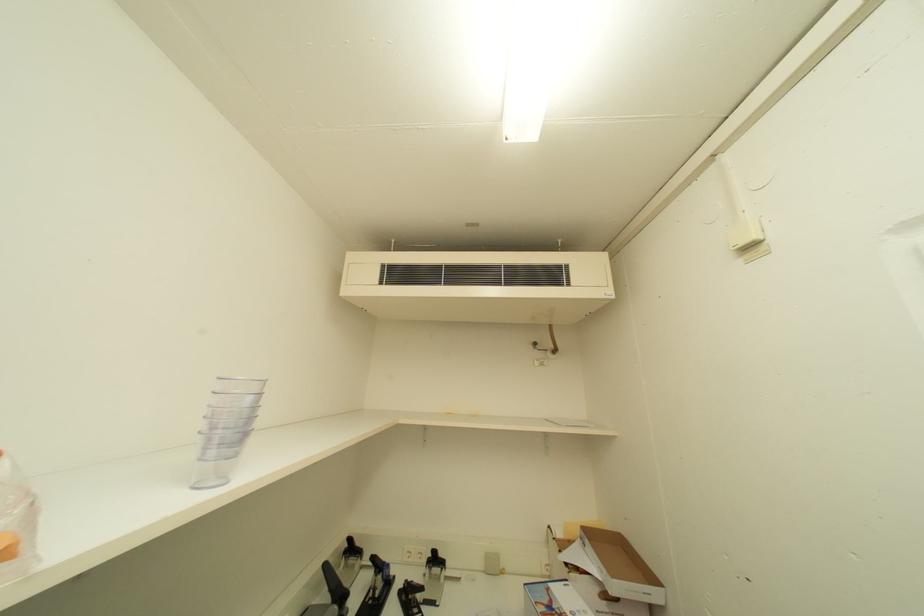
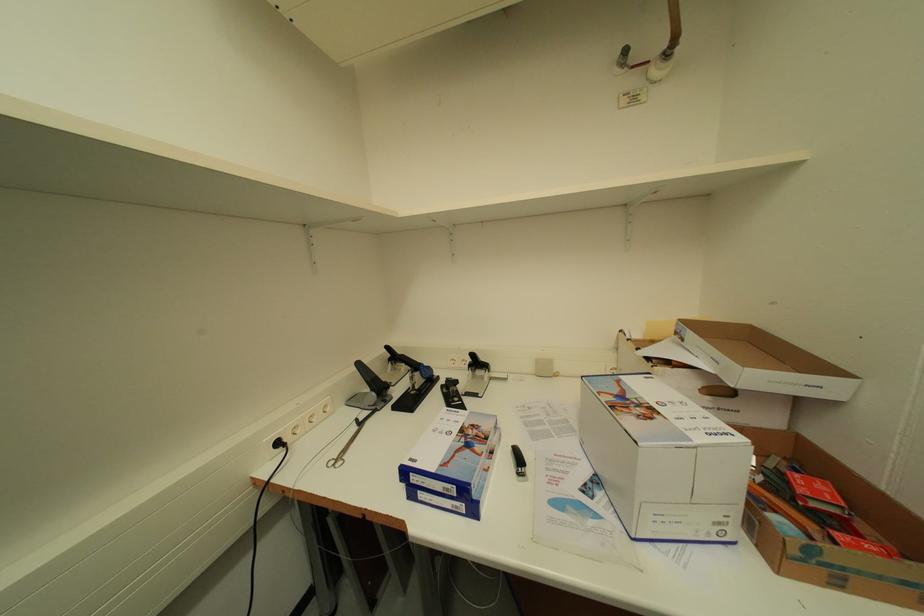
From the picture: The first image is from the beginning of the video and the second image is from the end. How did the camera likely rotate when shooting the video?

The camera's rotation is toward left-down.